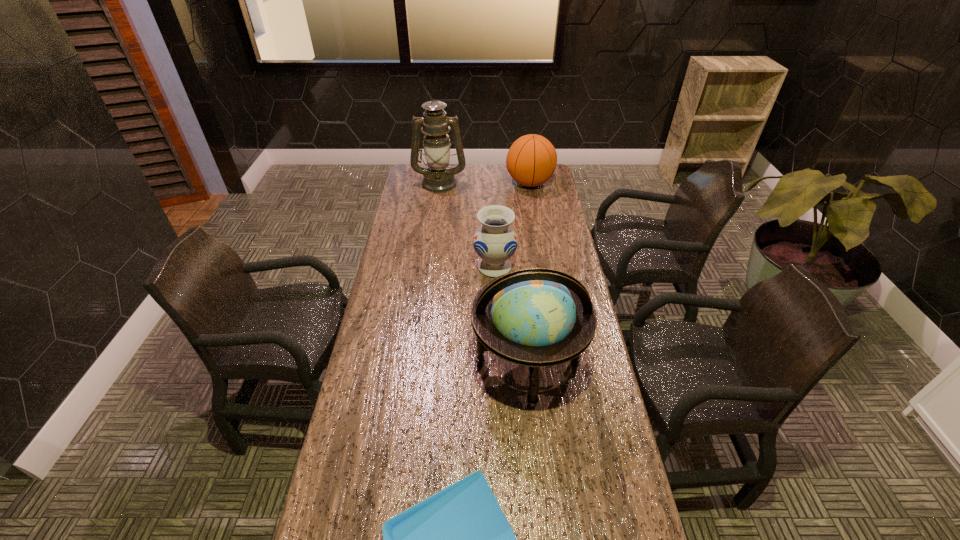
I want to click on oil lamp, so click(438, 178).

This screenshot has height=540, width=960. In order to click on globe in this screenshot , I will do `click(538, 317)`.

Find the location of a particular element. basketball is located at coordinates click(x=531, y=160).

You are a GUI agent. You are given a task and a screenshot of the screen. Output one action in this format:
    pyautogui.click(x=<x>, y=<y>)
    Task: Click on the third nearest object
    This screenshot has width=960, height=540.
    Given the screenshot: What is the action you would take?
    pyautogui.click(x=495, y=241)

Where is `free space located 0.270m on the front of the oil lamp`? free space located 0.270m on the front of the oil lamp is located at coordinates (434, 225).

In order to click on vacant area situated 0.320m on the surface of the fourth farthest object in this screenshot , I will do `click(544, 539)`.

Image resolution: width=960 pixels, height=540 pixels. Find the location of `vacant space located 0.080m on the back of the basketball`. vacant space located 0.080m on the back of the basketball is located at coordinates (526, 164).

At what (x,y) coordinates should I click in order to perform the action: click on free space located on the front of the third farthest object. Please return your answer as a coordinate pair (x, y). The width and height of the screenshot is (960, 540). Looking at the image, I should click on (497, 347).

At what (x,y) coordinates should I click in order to perform the action: click on oil lamp present at the far edge. Please return your answer as a coordinate pair (x, y). Looking at the image, I should click on pyautogui.click(x=438, y=178).

This screenshot has height=540, width=960. Find the location of `basketball present at the far edge`. basketball present at the far edge is located at coordinates (531, 160).